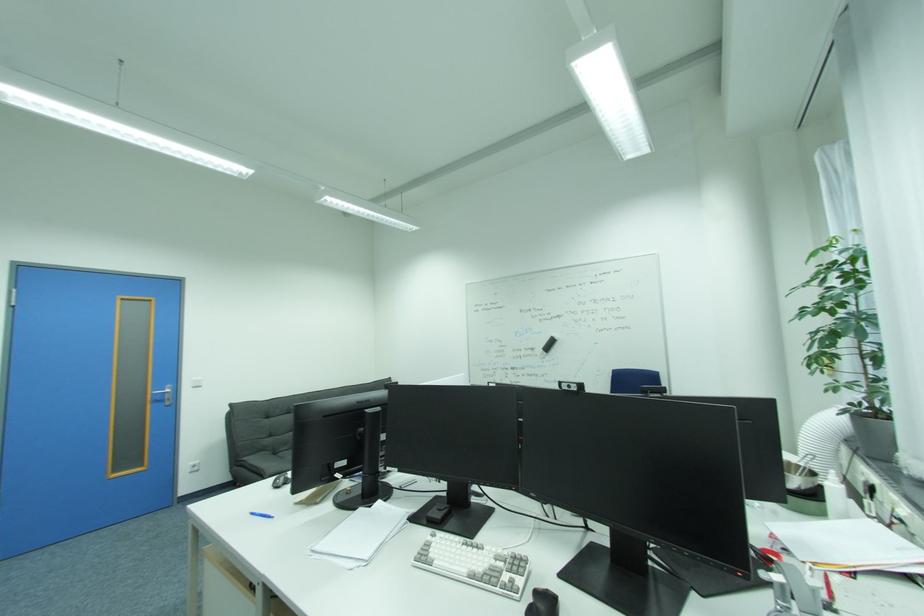
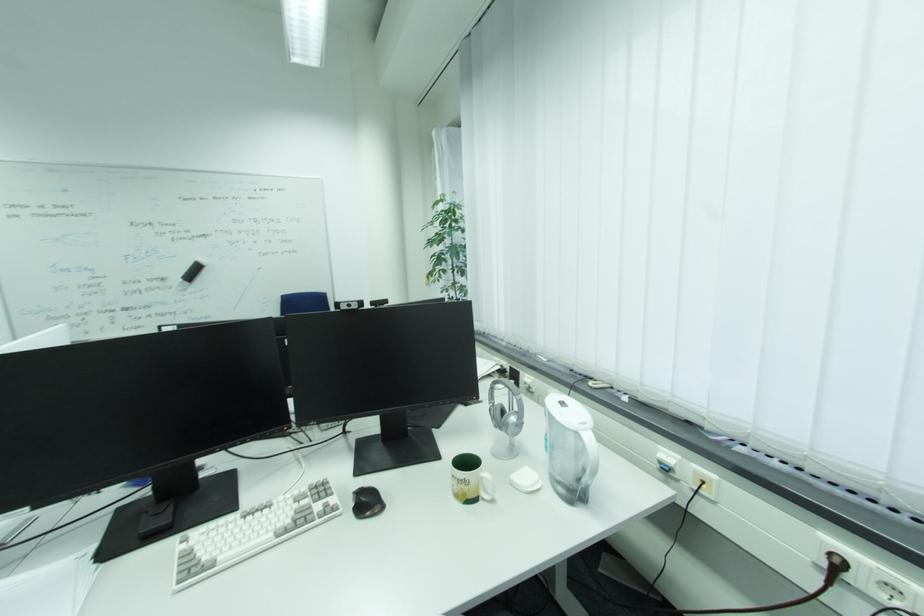
Locate, in the second image, the point that corresponds to (569,386) in the first image.

(348, 304)